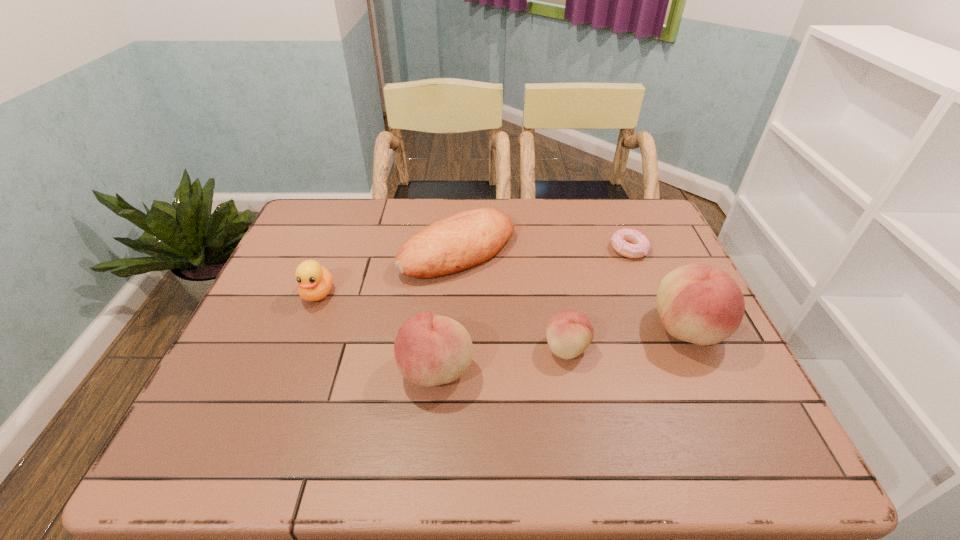
At what (x,y) coordinates should I click in order to perform the action: click on vacant area that lies between the rightmost peach and the leftmost object. Please return your answer as a coordinate pair (x, y). Looking at the image, I should click on (503, 311).

Locate an element on the screen. This screenshot has width=960, height=540. unoccupied area between the duckling and the rightmost peach is located at coordinates (503, 311).

What are the coordinates of `free spot between the duckling and the second tallest object` in the screenshot? It's located at (377, 332).

Image resolution: width=960 pixels, height=540 pixels. I want to click on blank region between the second peach from right to left and the rightmost peach, so [x=627, y=338].

Locate an element on the screen. The height and width of the screenshot is (540, 960). object that is the fourth nearest to the fifth shortest object is located at coordinates (701, 304).

The image size is (960, 540). I want to click on object that is the closest to the second tallest peach, so coord(569,332).

Point out which peach is positioned as the second nearest to the fifth shortest object. Please provide its 2D coordinates. Your answer should be formatted as a tuple, i.e. [(x, y)], where the tuple contains the x and y coordinates of a point satisfying the conditions above.

[(701, 304)]

Choose which peach is the second nearest neighbor to the rightmost peach. Please provide its 2D coordinates. Your answer should be formatted as a tuple, i.e. [(x, y)], where the tuple contains the x and y coordinates of a point satisfying the conditions above.

[(430, 350)]

This screenshot has width=960, height=540. What are the coordinates of `blank area in the image that satisfies the following two spatial constraints: 1. on the face of the leftmost peach; 2. on the left side of the leftmost object` in the screenshot? It's located at (288, 369).

At what (x,y) coordinates should I click in order to perform the action: click on vacant position in the image that satisfies the following two spatial constraints: 1. on the face of the rightmost peach; 2. on the right side of the duckling. Please return your answer as a coordinate pair (x, y). The height and width of the screenshot is (540, 960). Looking at the image, I should click on (304, 328).